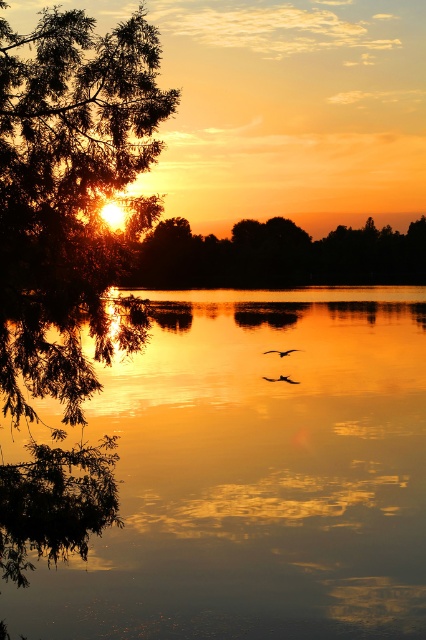
Is the position of glossy reflective water at center less distant than that of green leafy tree at left?

No, glossy reflective water at center is behind green leafy tree at left.

Who is more forward, (216, 636) or (101, 90)?

Point (101, 90) is in front.

Does point (310, 593) come closer to viewer compared to point (13, 419)?

No, (310, 593) is behind (13, 419).

Locate an element on the screen. Image resolution: width=426 pixels, height=640 pixels. glossy reflective water at center is located at coordinates (256, 476).

Looking at this image, who is higher up, glossy reflective water at center or silhouette glossy bird at center?

glossy reflective water at center is higher up.

Describe the element at coordinates (256, 476) in the screenshot. I see `glossy reflective water at center` at that location.

Find the location of `glossy reflective water at center`. glossy reflective water at center is located at coordinates (256, 476).

Does green leafy tree at left have a lesser height compared to green leafy tree at center?

No.

Which of these two, green leafy tree at left or green leafy tree at center, stands taller?

green leafy tree at left is taller.

Is point (75, 250) closer to viewer compared to point (137, 262)?

Yes, it is.

Locate an element on the screen. The height and width of the screenshot is (640, 426). green leafy tree at left is located at coordinates (71, 198).